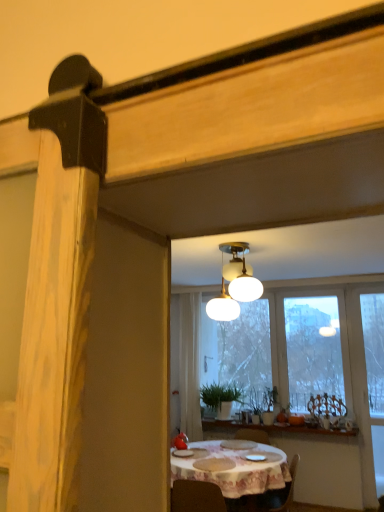
Question: From a real-world perspective, is white frosted glass lamp at upper center on top of white ceramic window sill at center?

Choices:
 (A) yes
 (B) no

Answer: (A)

Question: Could you tell me if white frosted glass lamp at upper center is turned towards white ceramic window sill at center?

Choices:
 (A) yes
 (B) no

Answer: (B)

Question: From a real-world perspective, is white frosted glass lamp at upper center beneath white ceramic window sill at center?

Choices:
 (A) yes
 (B) no

Answer: (B)

Question: Is white frosted glass lamp at upper center wider than white ceramic window sill at center?

Choices:
 (A) no
 (B) yes

Answer: (B)

Question: Is white frosted glass lamp at upper center surrounding white ceramic window sill at center?

Choices:
 (A) no
 (B) yes

Answer: (A)

Question: Is white cloth-covered table at center taller or shorter than white sheer curtain at center?

Choices:
 (A) short
 (B) tall

Answer: (A)

Question: Do you think white cloth-covered table at center is within white sheer curtain at center, or outside of it?

Choices:
 (A) outside
 (B) inside

Answer: (A)

Question: From a real-world perspective, relative to white sheer curtain at center, is white cloth-covered table at center vertically above or below?

Choices:
 (A) above
 (B) below

Answer: (B)

Question: Does point (180, 459) appear closer or farther from the camera than point (182, 315)?

Choices:
 (A) farther
 (B) closer

Answer: (B)

Question: Is transparent glass window at center in front of or behind white cloth-covered table at center in the image?

Choices:
 (A) behind
 (B) front

Answer: (A)

Question: From the image's perspective, is transparent glass window at center located above or below white cloth-covered table at center?

Choices:
 (A) below
 (B) above

Answer: (B)

Question: In the image, is transparent glass window at center on the left side or the right side of white cloth-covered table at center?

Choices:
 (A) left
 (B) right

Answer: (B)

Question: Does point (268, 323) appear closer or farther from the camera than point (264, 467)?

Choices:
 (A) farther
 (B) closer

Answer: (A)

Question: From a real-world perspective, is green matte plant at center positioned above or below white cloth-covered table at center?

Choices:
 (A) below
 (B) above

Answer: (B)

Question: Visually, is green matte plant at center positioned to the left or to the right of white cloth-covered table at center?

Choices:
 (A) left
 (B) right

Answer: (B)